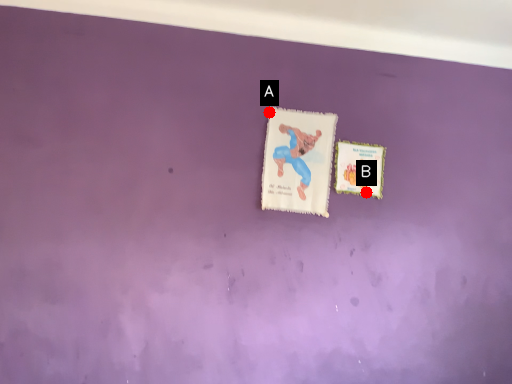
Question: Two points are circled on the image, labeled by A and B beside each circle. Which of the following is the farthest from the observer?

Choices:
 (A) A is further
 (B) B is further

Answer: (A)